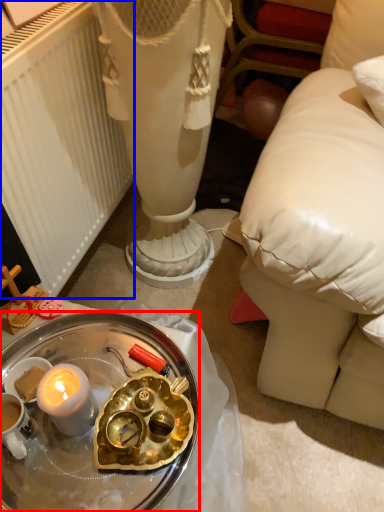
Question: Among these objects, which one is nearest to the camera, desk (highlighted by a red box) or radiator (highlighted by a blue box)?

Choices:
 (A) desk
 (B) radiator

Answer: (A)